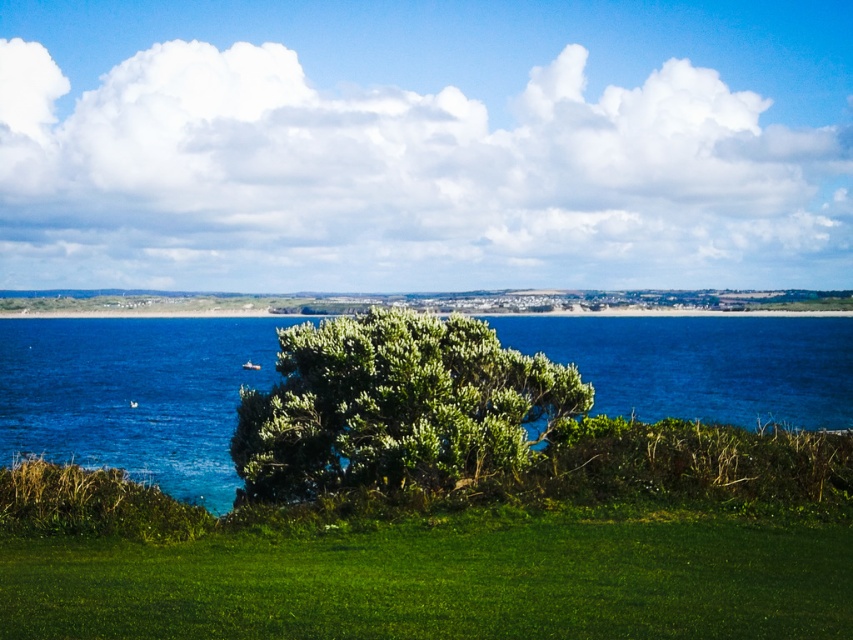
Can you confirm if green grassy at lower center is smaller than blue water at center?

Correct, green grassy at lower center occupies less space than blue water at center.

Who is more forward, (274, 580) or (500, 339)?

Point (274, 580)

Does point (635, 532) come behind point (148, 320)?

No.

Where is `green grassy at lower center`? The width and height of the screenshot is (853, 640). green grassy at lower center is located at coordinates (445, 579).

Which of these two, blue water at center or green leafy bush at center, stands taller?

blue water at center is taller.

Between blue water at center and green leafy bush at center, which one is positioned higher?

blue water at center is above.

Image resolution: width=853 pixels, height=640 pixels. In order to click on blue water at center in this screenshot , I will do `click(134, 394)`.

How distant is green grassy at lower center from green leafy bush at center?

green grassy at lower center and green leafy bush at center are 5.53 meters apart from each other.

Does green grassy at lower center have a greater height compared to green leafy bush at center?

No.

Locate an element on the screen. The image size is (853, 640). green grassy at lower center is located at coordinates (445, 579).

In order to click on green grassy at lower center in this screenshot , I will do `click(445, 579)`.